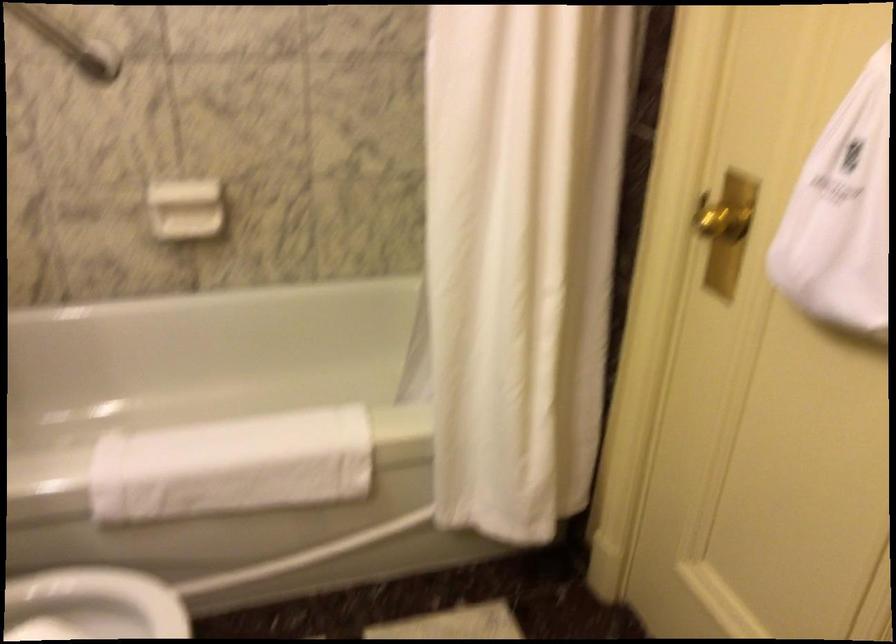
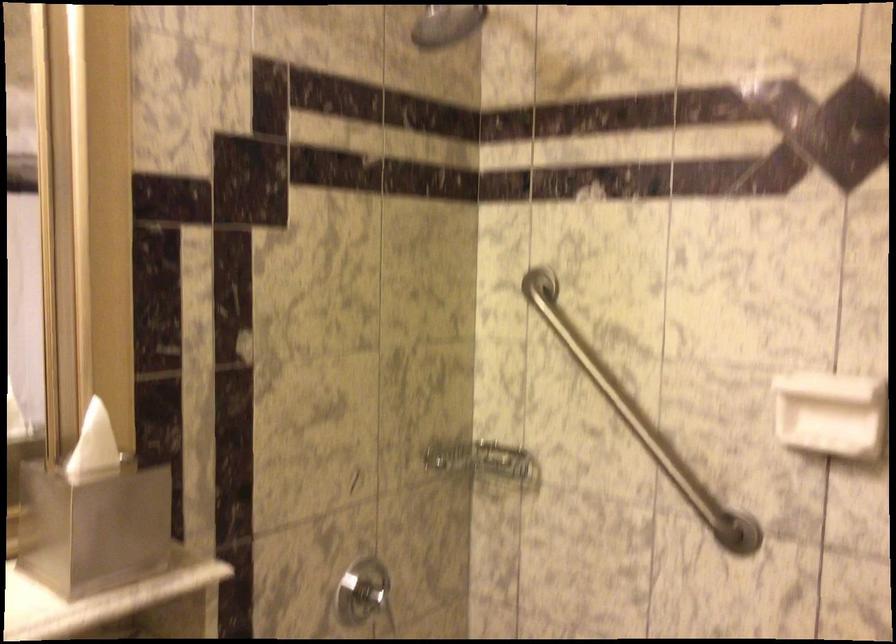
Question: How did the camera likely rotate?

Choices:
 (A) Left
 (B) Right
 (C) Up
 (D) Down

Answer: (A)